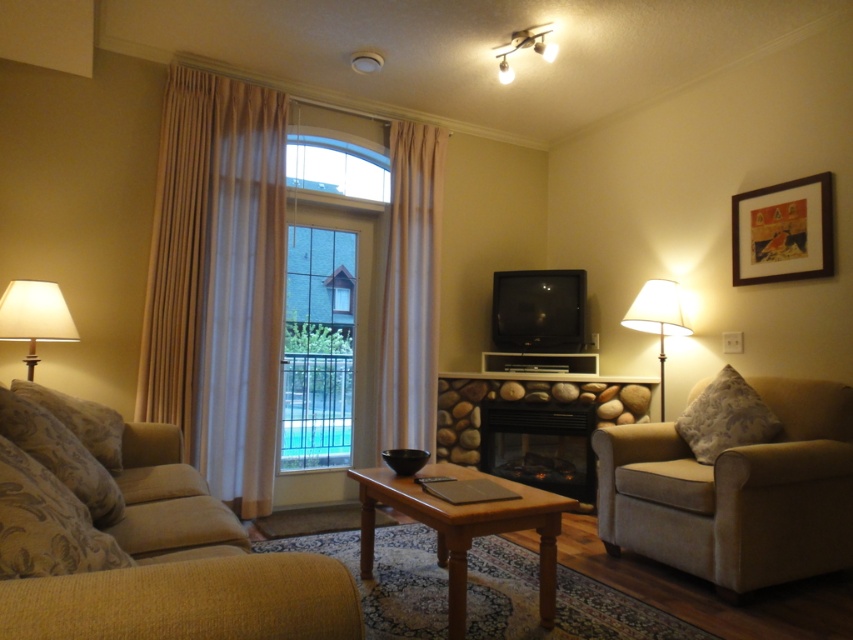
Question: Is beige fabric curtain at center positioned behind white fabric lampshade at right?

Choices:
 (A) yes
 (B) no

Answer: (A)

Question: Which object appears farthest from the camera in this image?

Choices:
 (A) clear glass door at center
 (B) light brown wooden coffee table at center
 (C) beige fabric curtain at center

Answer: (C)

Question: Can you confirm if clear glass door at center is bigger than black glass fireplace at center?

Choices:
 (A) yes
 (B) no

Answer: (A)

Question: Can you confirm if beige fabric curtain at center is wider than light brown wooden coffee table at center?

Choices:
 (A) no
 (B) yes

Answer: (A)

Question: Which is nearer to the beige fabric curtain at center?

Choices:
 (A) clear glass door at center
 (B) white fabric lampshade at left

Answer: (A)

Question: Which object appears farthest from the camera in this image?

Choices:
 (A) beige fabric curtain at center
 (B) light brown wooden coffee table at center

Answer: (A)